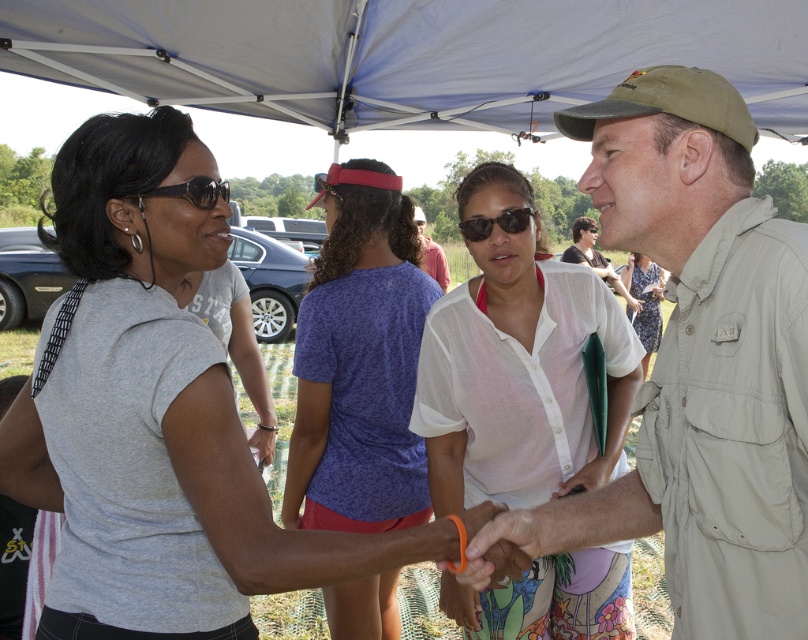
Question: Based on their relative distances, which object is nearer to the purple speckled shirt at center?

Choices:
 (A) khaki fabric shirt at center
 (B) white cotton shirt at center
 (C) white cotton dress at center

Answer: (A)

Question: Estimate the real-world distances between objects in this image. Which object is closer to the black reflective sunglasses at upper left?

Choices:
 (A) blue fabric canopy at upper center
 (B) white cotton dress at center

Answer: (A)

Question: Can you confirm if blue fabric canopy at upper center is wider than tan canvas hat at upper center?

Choices:
 (A) yes
 (B) no

Answer: (A)

Question: Is purple speckled shirt at center wider than black reflective sunglasses at upper left?

Choices:
 (A) no
 (B) yes

Answer: (B)

Question: Is matte gray t-shirt at center to the right of purple speckled shirt at center from the viewer's perspective?

Choices:
 (A) no
 (B) yes

Answer: (A)

Question: Which point is farther to the camera?

Choices:
 (A) (600, 260)
 (B) (499, 218)

Answer: (A)